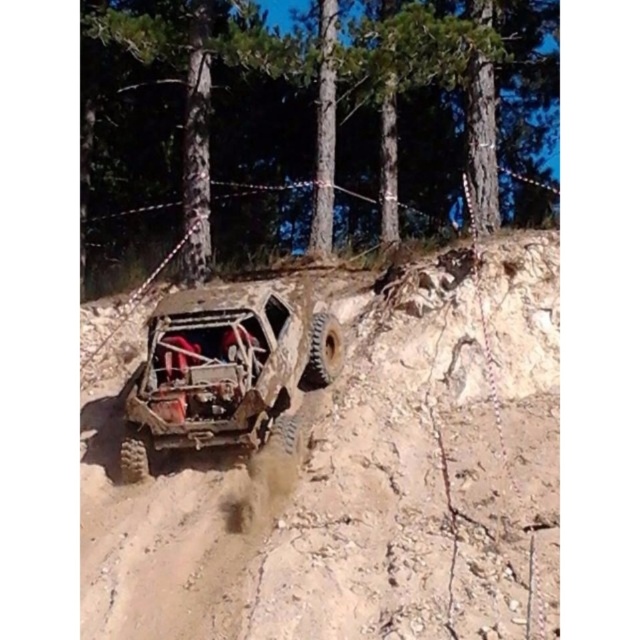
Question: Can you confirm if dusty brown terrain at center is smaller than rusty metal jeep at center?

Choices:
 (A) yes
 (B) no

Answer: (A)

Question: Does dusty brown terrain at center have a greater width compared to rusty metal jeep at center?

Choices:
 (A) yes
 (B) no

Answer: (B)

Question: Which point is farther to the camera?

Choices:
 (A) dusty brown terrain at center
 (B) rusty metal jeep at center

Answer: (A)

Question: Which object appears closest to the camera in this image?

Choices:
 (A) dusty brown terrain at center
 (B) rusty metal jeep at center

Answer: (B)

Question: Considering the relative positions of dusty brown terrain at center and rusty metal jeep at center in the image provided, where is dusty brown terrain at center located with respect to rusty metal jeep at center?

Choices:
 (A) above
 (B) below

Answer: (B)

Question: Which point is farther from the camera taking this photo?

Choices:
 (A) (148, 323)
 (B) (490, 317)

Answer: (B)